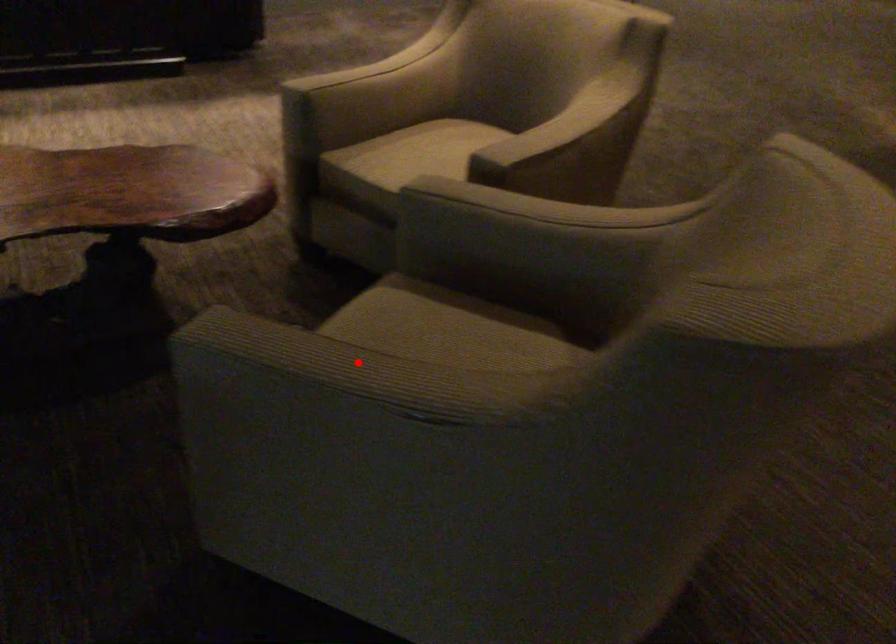
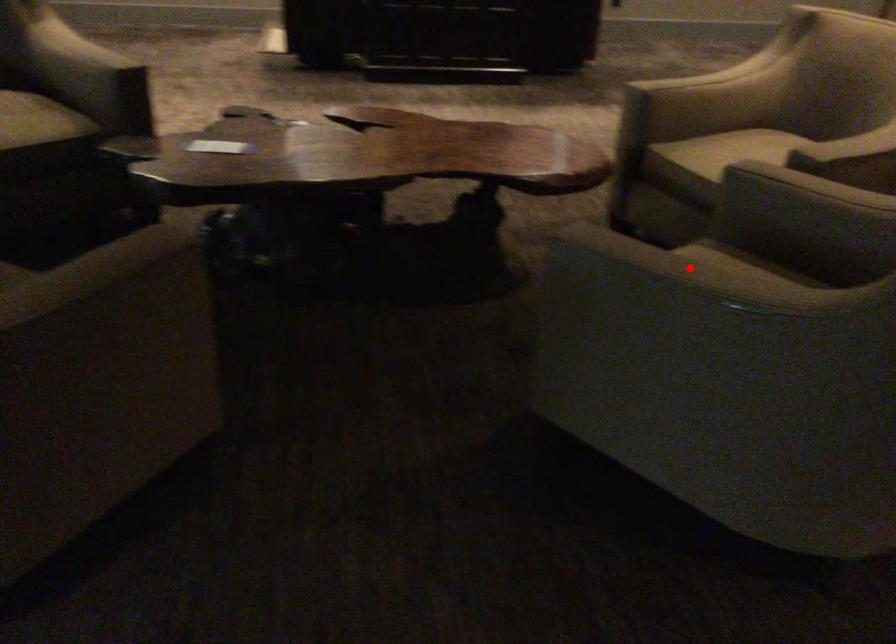
I am providing you with two images of the same scene from different viewpoints. A red point is marked on the first image and another point is marked on the second image. Is the red point in image1 aligned with the point shown in image2?

Yes